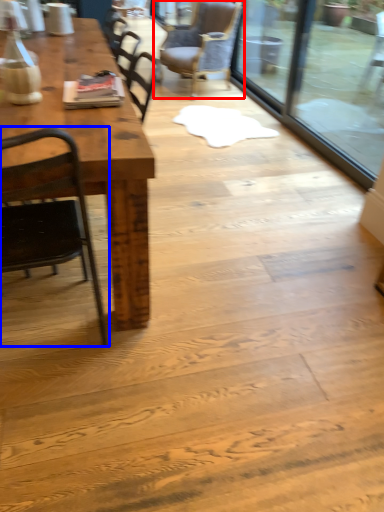
Question: Which object is closer to the camera taking this photo, chair (highlighted by a red box) or chair (highlighted by a blue box)?

Choices:
 (A) chair
 (B) chair

Answer: (B)